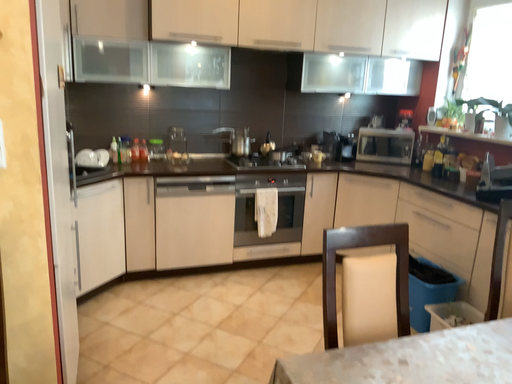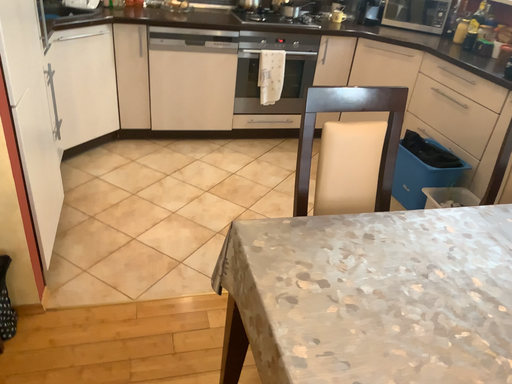
Question: Which way did the camera rotate in the video?

Choices:
 (A) rotated upward
 (B) rotated downward

Answer: (B)